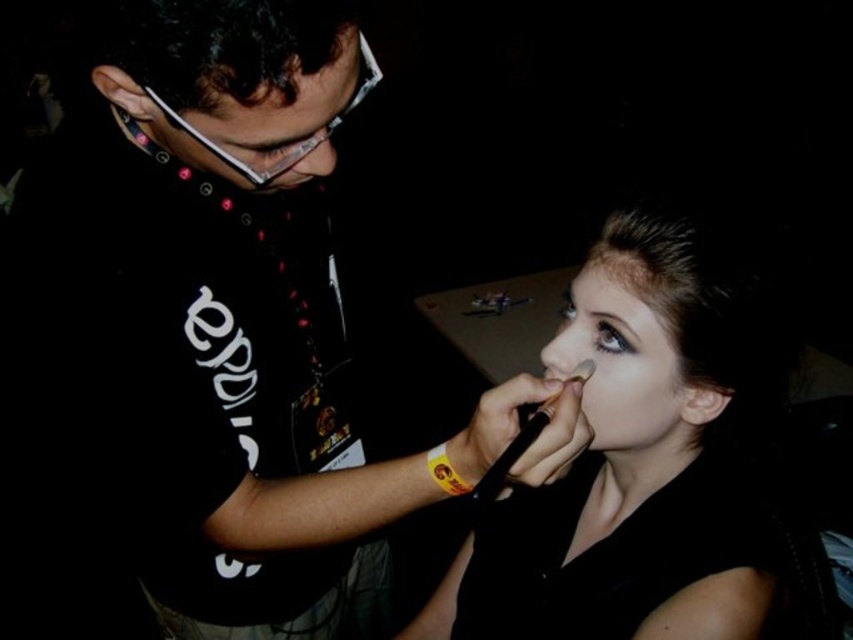
Is matte black shirt at center wider than matte black makeup brush at right?

Correct, the width of matte black shirt at center exceeds that of matte black makeup brush at right.

Which of these two, matte black shirt at center or matte black makeup brush at right, stands taller?

With more height is matte black shirt at center.

Does point (292, 412) lie behind point (793, 634)?

Yes, point (292, 412) is behind point (793, 634).

I want to click on matte black shirt at center, so click(225, 326).

Between matte black makeup brush at right and matte black glasses at upper left, which one appears on the left side from the viewer's perspective?

matte black glasses at upper left is more to the left.

Locate an element on the screen. matte black makeup brush at right is located at coordinates (648, 467).

Where is `matte black makeup brush at right`? matte black makeup brush at right is located at coordinates (648, 467).

Does matte black makeup brush at right appear on the right side of matte black face at center?

Correct, you'll find matte black makeup brush at right to the right of matte black face at center.

Which of these two, matte black makeup brush at right or matte black face at center, stands taller?

matte black makeup brush at right

Between point (697, 428) and point (665, 365), which one is positioned in front?

Point (665, 365)

The image size is (853, 640). Identify the location of matte black makeup brush at right. (648, 467).